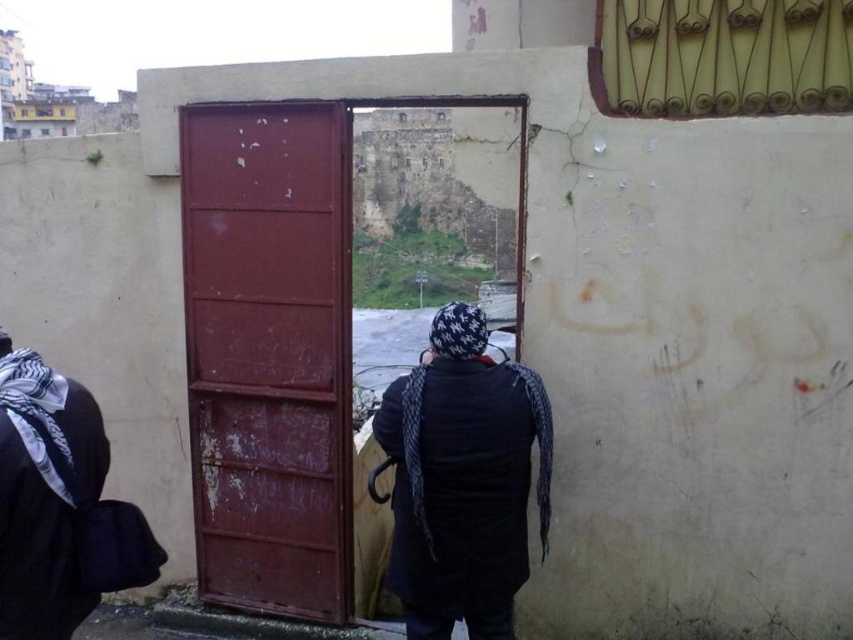
Consider the image. You are a delivery person trying to reach the doorbell located on the rusty metal door at center. You have a package that requires you to be within 3 feet to scan it. Can you scan the package while standing at the position of the black knit cap at center?

The rusty metal door at center is 3.29 feet away from the black knit cap at center. Since the required distance is within 3 feet to scan the package, the delivery person cannot scan the package while standing at the position of the black knit cap at center because they are slightly farther than the required distance.

Looking at this image, you are a painter who needs to decide whether to bring a ladder or a stool to paint the rusty metal door at center and the black knit cap at center. Based on their sizes, which tool would be more appropriate for each object?

The rusty metal door at center is larger than the black knit cap at center, so you should bring a ladder for the rusty metal door at center and a stool for the black knit cap at center.

You are a delivery person standing at the entrance. You need to hand over a package to someone inside the building. The package is too large to fit through the door. You see the rusty metal door at center and the black knit cap at center. Which object should you move to access the door handle?

The rusty metal door at center is to the left of black knit cap at center, so you should move to the right of the black knit cap at center to access the door handle on the rusty metal door at center.